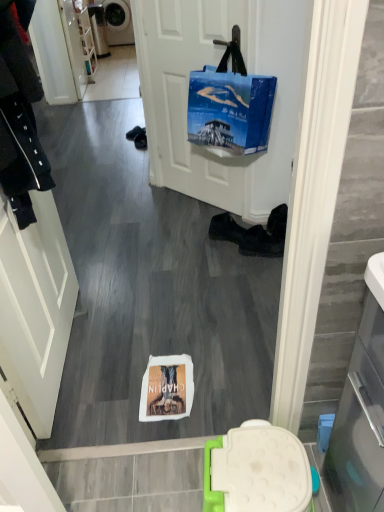
Find the location of a particular element. The image size is (384, 512). vacant area that is in front of white glossy door at left is located at coordinates [x=84, y=398].